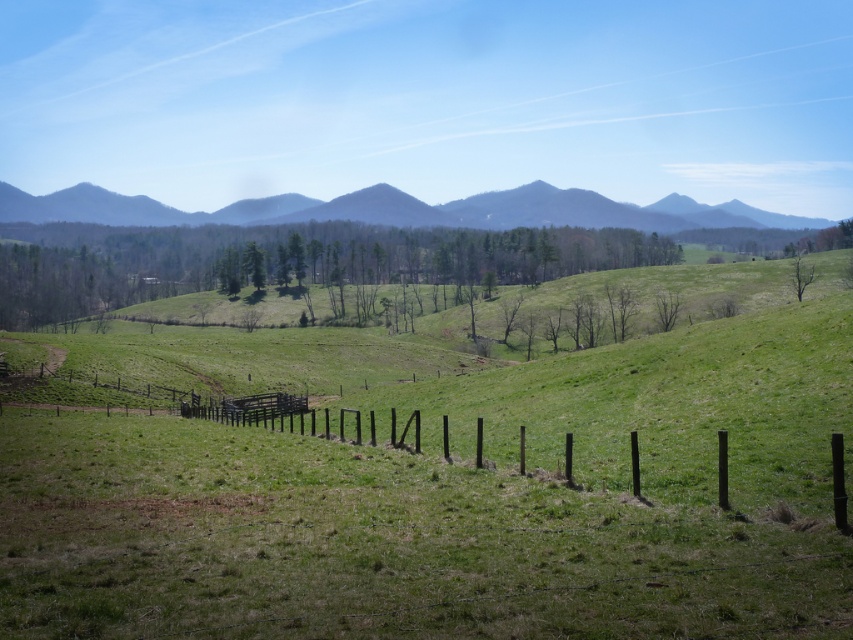
Question: Estimate the real-world distances between objects in this image. Which object is closer to the green leafy trees at center?

Choices:
 (A) grayish-blue mountain range at upper center
 (B) brown wooden fence at center

Answer: (A)

Question: Which point is farther to the camera?

Choices:
 (A) (218, 420)
 (B) (399, 252)

Answer: (B)

Question: Can you confirm if brown wooden fence at center is wider than grayish-blue mountain range at upper center?

Choices:
 (A) no
 (B) yes

Answer: (A)

Question: Does grayish-blue mountain range at upper center have a greater width compared to green leafy tree at upper right?

Choices:
 (A) yes
 (B) no

Answer: (A)

Question: Which object is closer to the camera taking this photo?

Choices:
 (A) green leafy tree at upper right
 (B) brown wooden fence at center
 (C) grayish-blue mountain range at upper center

Answer: (B)

Question: Is brown wooden fence at center to the left of green leafy trees at center from the viewer's perspective?

Choices:
 (A) yes
 (B) no

Answer: (B)